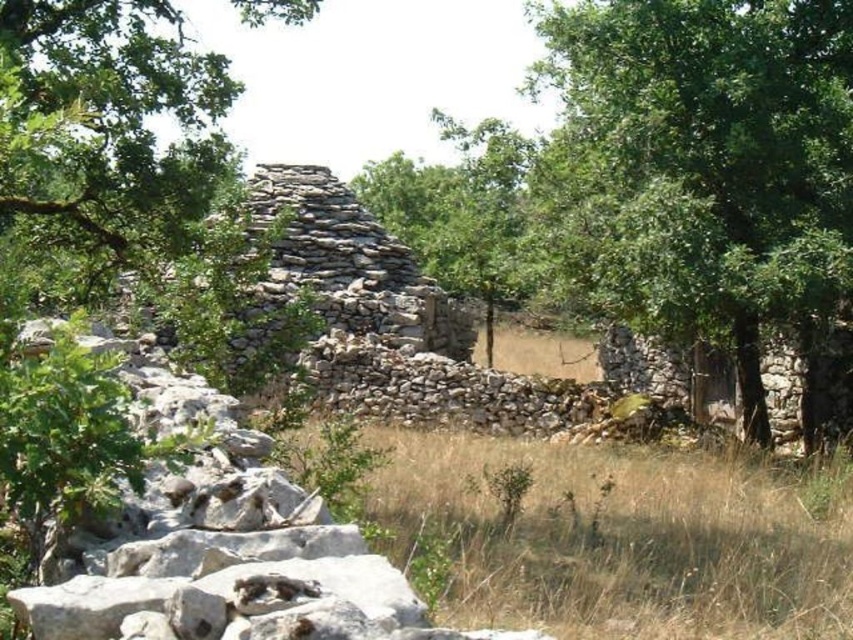
You are a hiker who wants to take a photo of the green leafy tree at center and the dry grass at center. Which object should you focus on first if you want both to be in sharp focus?

The green leafy tree at center is bigger than dry grass at center, so you should focus on the green leafy tree at center first to ensure both are in sharp focus.